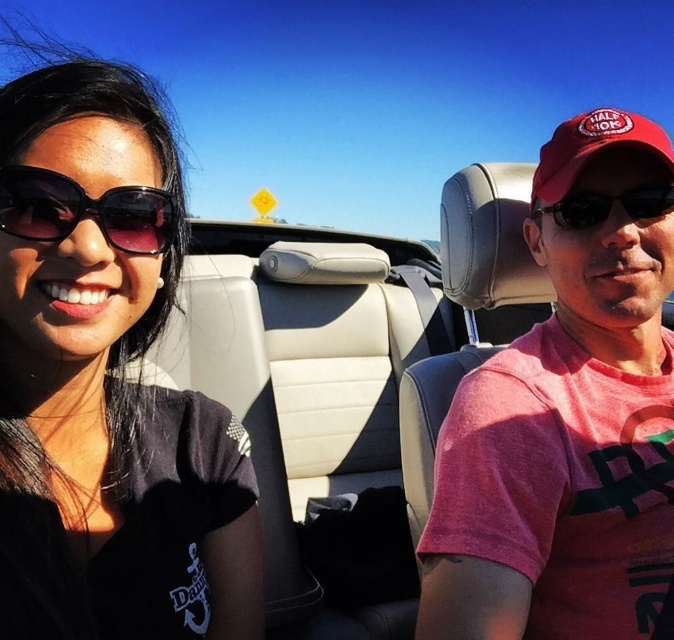
Question: Observing the image, what is the correct spatial positioning of pink cotton shirt at center in reference to red fabric baseball cap at upper right?

Choices:
 (A) below
 (B) above

Answer: (A)

Question: In this image, where is black matte sunglasses at upper left located relative to red fabric baseball cap at upper right?

Choices:
 (A) below
 (B) above

Answer: (A)

Question: Which object is positioned closest to the red fabric baseball cap at upper right?

Choices:
 (A) black plastic sunglasses at right
 (B) pink cotton shirt at center
 (C) matte black sunglasses at left

Answer: (A)

Question: Considering the real-world distances, which object is farthest from the red fabric baseball cap at upper right?

Choices:
 (A) black matte sunglasses at upper left
 (B) black plastic sunglasses at right
 (C) pink cotton shirt at center

Answer: (A)

Question: Does black matte sunglasses at upper left have a larger size compared to black plastic sunglasses at right?

Choices:
 (A) yes
 (B) no

Answer: (A)

Question: Which point is closer to the camera taking this photo?

Choices:
 (A) tap(541, 164)
 (B) tap(642, 557)
 (C) tap(59, 237)
 (D) tap(547, 212)

Answer: (C)